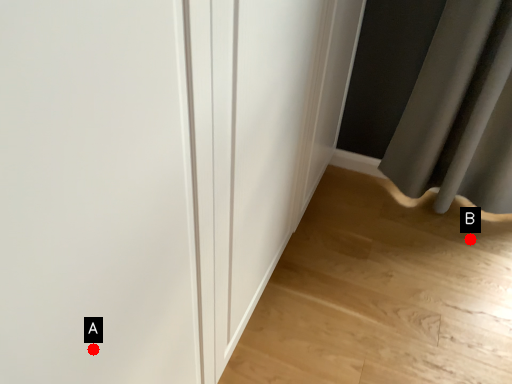
Question: Two points are circled on the image, labeled by A and B beside each circle. Which of the following is the closest to the observer?

Choices:
 (A) A is closer
 (B) B is closer

Answer: (A)